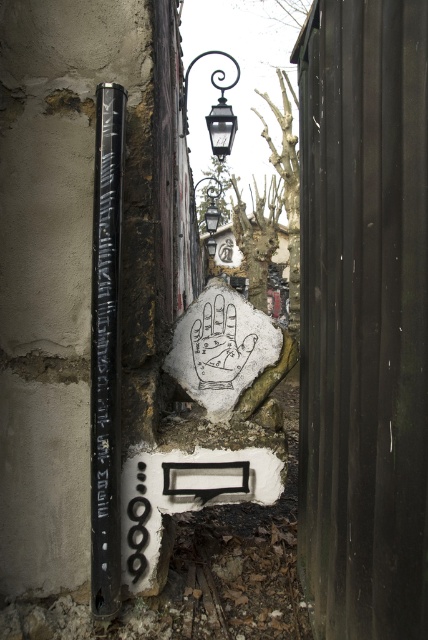
Question: Can you confirm if black polished metal pole at left is positioned below polished metal streetlamp at upper center?

Choices:
 (A) no
 (B) yes

Answer: (B)

Question: Which of the following is the closest to the observer?

Choices:
 (A) (216, 147)
 (B) (97, 513)

Answer: (B)

Question: Does black polished metal pole at left appear over polished metal streetlamp at upper center?

Choices:
 (A) yes
 (B) no

Answer: (B)

Question: Can you confirm if black polished metal pole at left is positioned above polished metal streetlamp at upper center?

Choices:
 (A) yes
 (B) no

Answer: (B)

Question: Which point is closer to the camera?

Choices:
 (A) pyautogui.click(x=115, y=428)
 (B) pyautogui.click(x=184, y=132)

Answer: (A)